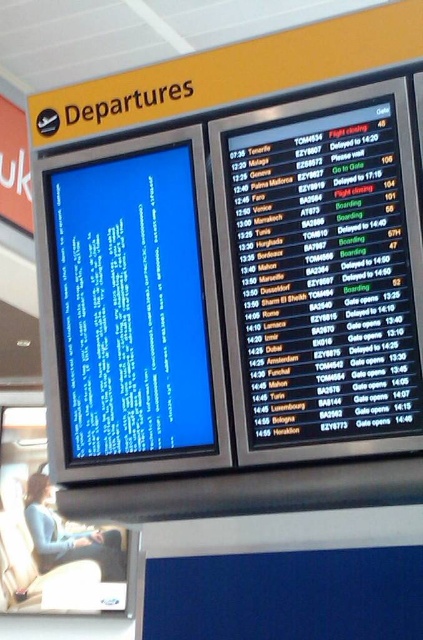
You are a traveler with a 8.5 inch wide laptop bag. You are standing between the black glossy departure board at upper right and the blue glossy screen at left. Can you fit your bag between them without tilting it sideways?

The black glossy departure board at upper right is 9.19 inches away from the blue glossy screen at left. Since your bag is 8.5 inches wide, it should fit between them without tilting sideways as there is enough space.

You are a traveler at the airport and need to check your flight status. You see the black glossy departure board at upper right and the blue glossy screen at left. Which one should you look at to find your flight information?

The blue glossy screen at left displays flight information, so you should look at the blue glossy screen at left to find your flight status.

You are at an airport and need to check flight information. You see a black glossy departure board at upper right and a blue glossy screen at left. Which board should you look at to find flight details?

The blue glossy screen at left is the one displaying flight information, while the black glossy departure board at upper right is larger but currently showing a system error message. Therefore, you should look at the blue glossy screen at left for flight details.